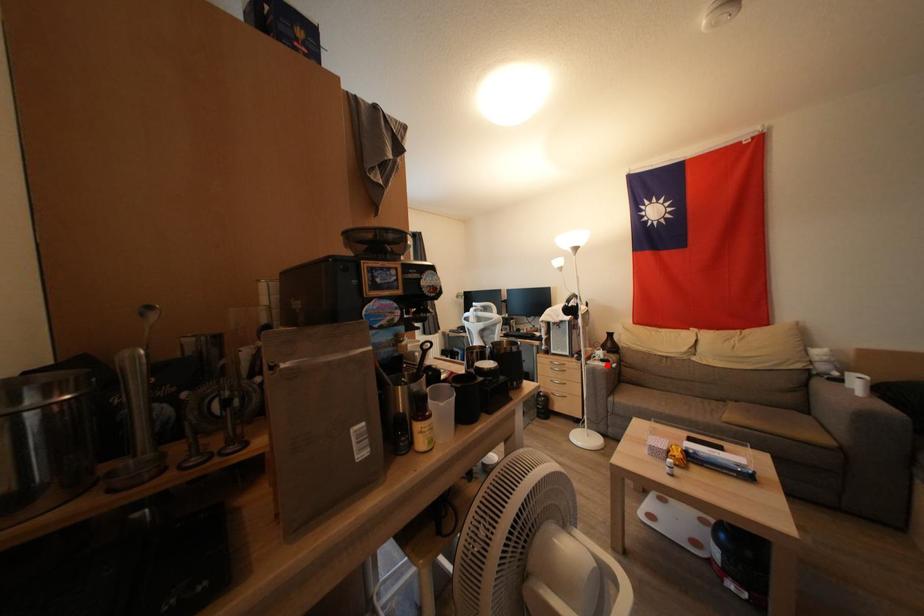
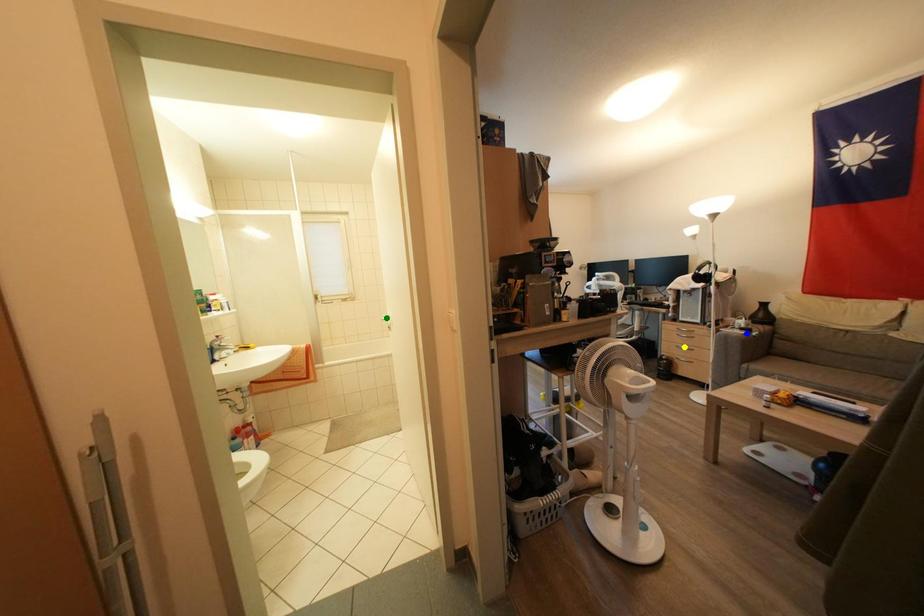
Question: I am providing you with two images of the same scene from different viewpoints. A red point is marked on the first image. You are given multiple points on the second image. Which spot in image 2 lines up with the point in image 1?

Choices:
 (A) green point
 (B) yellow point
 (C) blue point

Answer: (C)